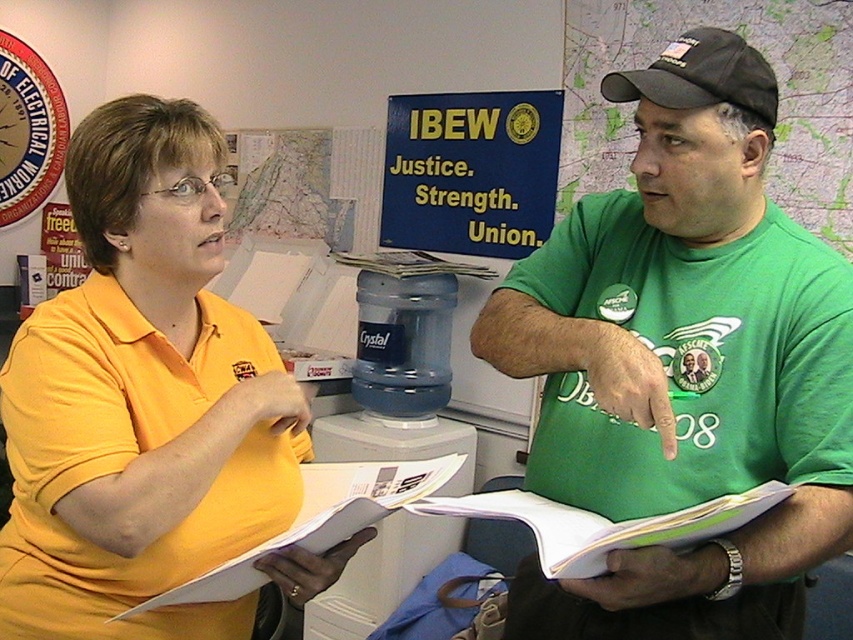
Which is in front, point (647, 49) or point (389, 451)?

Point (647, 49)

This screenshot has height=640, width=853. Identify the location of black fabric cap at upper right. (769, 61).

Identify the location of black fabric cap at upper right. (769, 61).

Is green cotton shirt at center to the right of white plastic water cooler at center from the viewer's perspective?

Correct, you'll find green cotton shirt at center to the right of white plastic water cooler at center.

Between green cotton shirt at center and white plastic water cooler at center, which one has more height?

With more height is green cotton shirt at center.

Between point (769, 557) and point (401, 433), which one is positioned in front?

Point (769, 557) is more forward.

Image resolution: width=853 pixels, height=640 pixels. I want to click on green cotton shirt at center, so pyautogui.click(x=683, y=364).

Does point (628, 8) lie in front of point (758, 92)?

No, (628, 8) is behind (758, 92).

The image size is (853, 640). Identify the location of black fabric cap at upper right. (769, 61).